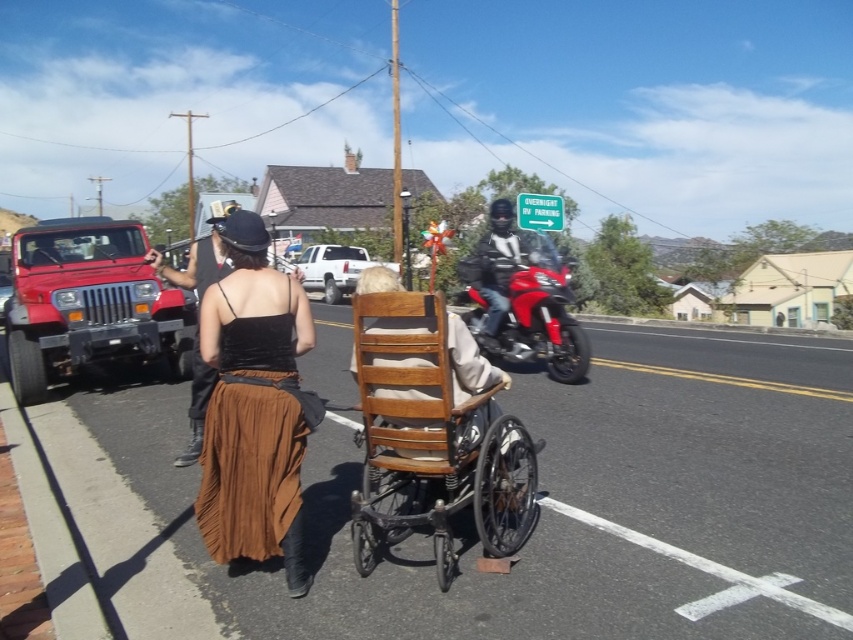
From the picture: Which is more to the right, matte red jeep at left or shiny black motorcycle at center?

Positioned to the right is shiny black motorcycle at center.

Looking at this image, between matte red jeep at left and shiny black motorcycle at center, which one is positioned lower?

matte red jeep at left is below.

Is point (144, 358) in front of point (503, 243)?

No, (144, 358) is further to viewer.

Find the location of `matte red jeep at left`. matte red jeep at left is located at coordinates (88, 304).

Is shiny red motorcycle at center shorter than white matte truck at center?

Yes.

Is point (468, 310) farther from viewer compared to point (315, 288)?

That is False.

Is point (584, 364) less distant than point (332, 244)?

Yes, point (584, 364) is in front of point (332, 244).

Where is `shiny red motorcycle at center`? The image size is (853, 640). shiny red motorcycle at center is located at coordinates (540, 310).

Does woodenwoodenwheelchair at center have a greater width compared to matte black hat at upper center?

No.

Who is more distant from viewer, (381, 384) or (183, 288)?

Point (183, 288)

At what (x,y) coordinates should I click in order to perform the action: click on woodenwoodenwheelchair at center. Please return your answer as a coordinate pair (x, y). The image size is (853, 640). Looking at the image, I should click on (434, 449).